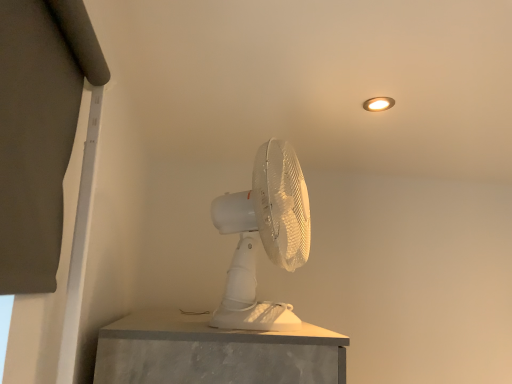
This screenshot has height=384, width=512. Identify the location of vacant region to the left of matte white light fixture at upper right. (x=320, y=100).